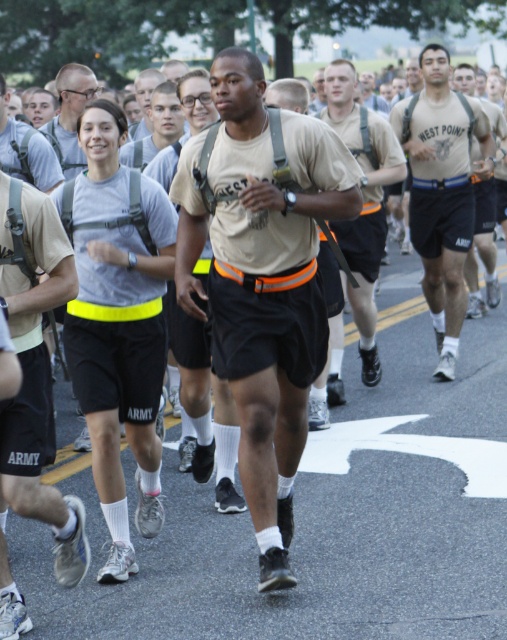
Question: Can you confirm if tan uniform shirt at center is positioned above tan uniform at center?

Choices:
 (A) no
 (B) yes

Answer: (B)

Question: Which object is farther from the camera taking this photo?

Choices:
 (A) gray matte shorts at center
 (B) tan matte uniform at center
 (C) matte gray shirt at upper center

Answer: (C)

Question: Is tan matte uniform at center thinner than tan uniform at center?

Choices:
 (A) yes
 (B) no

Answer: (B)

Question: Is tan matte uniform at center in front of gray matte shorts at center?

Choices:
 (A) no
 (B) yes

Answer: (B)

Question: Estimate the real-world distances between objects in this image. Which object is closer to the gray matte shorts at center?

Choices:
 (A) matte gray shirt at upper center
 (B) tan uniform at center

Answer: (A)

Question: Based on their relative distances, which object is farther from the tan uniform shirt at center?

Choices:
 (A) tan uniform at center
 (B) tan matte uniform at center

Answer: (B)